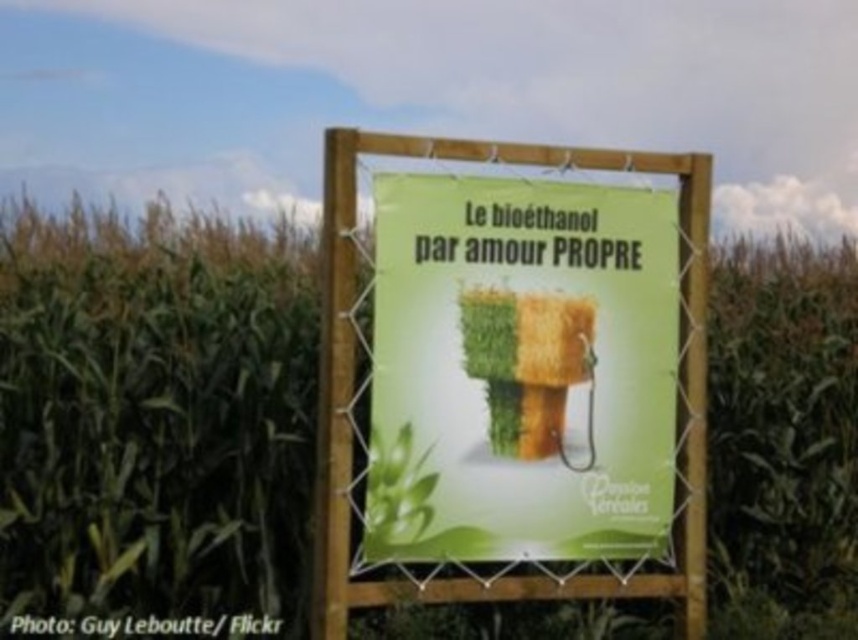
How much distance is there between green leafy corn at center and green paper sign at center?

green leafy corn at center is 2.72 meters from green paper sign at center.

Where is `green leafy corn at center`? green leafy corn at center is located at coordinates (154, 413).

Identify the location of green leafy corn at center. This screenshot has width=858, height=640. (154, 413).